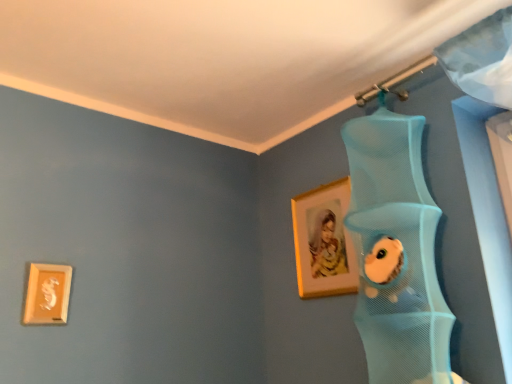
The width and height of the screenshot is (512, 384). I want to click on matte gold picture frame at upper center, the first picture frame when ordered from back to front, so click(323, 241).

What is the approximate height of matte gold picture frame at upper center, positioned as the second picture frame in front-to-back order?

matte gold picture frame at upper center, positioned as the second picture frame in front-to-back order, is 17.33 inches in height.

What do you see at coordinates (323, 241) in the screenshot?
I see `matte gold picture frame at upper center, acting as the 1th picture frame starting from the right` at bounding box center [323, 241].

Locate an element on the screen. The height and width of the screenshot is (384, 512). matte gold picture frame at lower left, arranged as the second picture frame when viewed from the right is located at coordinates (47, 294).

Describe the element at coordinates (47, 294) in the screenshot. I see `matte gold picture frame at lower left, arranged as the second picture frame when viewed from the right` at that location.

In order to face matte gold picture frame at lower left, acting as the second picture frame starting from the back, should I rotate leftwards or rightwards?

Rotate your view left by about 25.794°.

Where is `matte gold picture frame at upper center, the 2th picture frame viewed from the left`? Image resolution: width=512 pixels, height=384 pixels. matte gold picture frame at upper center, the 2th picture frame viewed from the left is located at coordinates (323, 241).

Visually, is matte gold picture frame at upper center, the 2th picture frame viewed from the left, positioned to the left or to the right of matte gold picture frame at lower left, which is counted as the 1th picture frame, starting from the front?

matte gold picture frame at upper center, the 2th picture frame viewed from the left, is to the right of matte gold picture frame at lower left, which is counted as the 1th picture frame, starting from the front.

Which object is further away from the camera taking this photo, matte gold picture frame at upper center, acting as the 1th picture frame starting from the right, or matte gold picture frame at lower left, acting as the second picture frame starting from the back?

matte gold picture frame at upper center, acting as the 1th picture frame starting from the right, is further away from the camera.

Does point (304, 205) come in front of point (60, 278)?

No.

From the image's perspective, is matte gold picture frame at upper center, the 2th picture frame viewed from the left, above or below matte gold picture frame at lower left, which is counted as the 1th picture frame, starting from the front?

matte gold picture frame at upper center, the 2th picture frame viewed from the left, is above matte gold picture frame at lower left, which is counted as the 1th picture frame, starting from the front.

From a real-world perspective, is matte gold picture frame at upper center, the first picture frame when ordered from back to front, positioned over matte gold picture frame at lower left, acting as the second picture frame starting from the back, based on gravity?

Indeed, from a real-world perspective, matte gold picture frame at upper center, the first picture frame when ordered from back to front, stands above matte gold picture frame at lower left, acting as the second picture frame starting from the back.

Can you confirm if matte gold picture frame at upper center, the first picture frame when ordered from back to front, is wider than matte gold picture frame at lower left, acting as the second picture frame starting from the back?

No.

Can you confirm if matte gold picture frame at upper center, the 2th picture frame viewed from the left, is shorter than matte gold picture frame at lower left, arranged as the second picture frame when viewed from the right?

No.

Considering the sizes of objects matte gold picture frame at upper center, the 2th picture frame viewed from the left, and matte gold picture frame at lower left, which is the first picture frame from left to right, in the image provided, who is bigger, matte gold picture frame at upper center, the 2th picture frame viewed from the left, or matte gold picture frame at lower left, which is the first picture frame from left to right,?

With larger size is matte gold picture frame at upper center, the 2th picture frame viewed from the left.

Would you say matte gold picture frame at upper center, the 2th picture frame viewed from the left, contains matte gold picture frame at lower left, which is the first picture frame from left to right?

That's incorrect, matte gold picture frame at lower left, which is the first picture frame from left to right, is not inside matte gold picture frame at upper center, the 2th picture frame viewed from the left.

Would you consider matte gold picture frame at upper center, positioned as the second picture frame in front-to-back order, to be distant from matte gold picture frame at lower left, which is the first picture frame from left to right?

That's not correct — matte gold picture frame at upper center, positioned as the second picture frame in front-to-back order, is a little close to matte gold picture frame at lower left, which is the first picture frame from left to right.

Is matte gold picture frame at upper center, acting as the 1th picture frame starting from the right, looking in the opposite direction of matte gold picture frame at lower left, which is the first picture frame from left to right?

No, matte gold picture frame at upper center, acting as the 1th picture frame starting from the right, is not facing away from matte gold picture frame at lower left, which is the first picture frame from left to right.

How many degrees apart are the facing directions of matte gold picture frame at upper center, acting as the 1th picture frame starting from the right, and matte gold picture frame at lower left, acting as the second picture frame starting from the back?

The angle between the facing direction of matte gold picture frame at upper center, acting as the 1th picture frame starting from the right, and the facing direction of matte gold picture frame at lower left, acting as the second picture frame starting from the back, is 90.2 degrees.

How much distance is there between matte gold picture frame at upper center, the 2th picture frame viewed from the left, and matte gold picture frame at lower left, acting as the second picture frame starting from the back?

matte gold picture frame at upper center, the 2th picture frame viewed from the left, and matte gold picture frame at lower left, acting as the second picture frame starting from the back, are 37.46 inches apart.

The height and width of the screenshot is (384, 512). Find the location of `picture frame that is on the right side of matte gold picture frame at lower left, which is the first picture frame from left to right`. picture frame that is on the right side of matte gold picture frame at lower left, which is the first picture frame from left to right is located at coordinates (323, 241).

Based on their positions, is matte gold picture frame at lower left, which is the first picture frame from left to right, located to the left or right of matte gold picture frame at upper center, the 2th picture frame viewed from the left?

matte gold picture frame at lower left, which is the first picture frame from left to right, is to the left of matte gold picture frame at upper center, the 2th picture frame viewed from the left.

In the scene shown: Considering the relative positions of matte gold picture frame at lower left, which is counted as the 1th picture frame, starting from the front, and matte gold picture frame at upper center, the first picture frame when ordered from back to front, in the image provided, is matte gold picture frame at lower left, which is counted as the 1th picture frame, starting from the front, behind matte gold picture frame at upper center, the first picture frame when ordered from back to front,?

No, the depth of matte gold picture frame at lower left, which is counted as the 1th picture frame, starting from the front, is less than that of matte gold picture frame at upper center, the first picture frame when ordered from back to front.

Does point (58, 265) appear closer or farther from the camera than point (304, 249)?

Point (58, 265) is positioned closer to the camera compared to point (304, 249).

From the image's perspective, is matte gold picture frame at lower left, which is the first picture frame from left to right, on top of matte gold picture frame at upper center, the 2th picture frame viewed from the left?

No, from the image's perspective, matte gold picture frame at lower left, which is the first picture frame from left to right, is not above matte gold picture frame at upper center, the 2th picture frame viewed from the left.

From the picture: From a real-world perspective, is matte gold picture frame at lower left, which is counted as the 1th picture frame, starting from the front, physically above matte gold picture frame at upper center, acting as the 1th picture frame starting from the right?

No, from a real-world perspective, matte gold picture frame at lower left, which is counted as the 1th picture frame, starting from the front, is not over matte gold picture frame at upper center, acting as the 1th picture frame starting from the right

Can you confirm if matte gold picture frame at lower left, acting as the second picture frame starting from the back, is wider than matte gold picture frame at upper center, the first picture frame when ordered from back to front?

Yes, matte gold picture frame at lower left, acting as the second picture frame starting from the back, is wider than matte gold picture frame at upper center, the first picture frame when ordered from back to front.

Between matte gold picture frame at lower left, acting as the second picture frame starting from the back, and matte gold picture frame at upper center, the 2th picture frame viewed from the left, which one has more height?

matte gold picture frame at upper center, the 2th picture frame viewed from the left, is taller.

Between matte gold picture frame at lower left, which is counted as the 1th picture frame, starting from the front, and matte gold picture frame at upper center, positioned as the second picture frame in front-to-back order, which one has larger size?

With larger size is matte gold picture frame at upper center, positioned as the second picture frame in front-to-back order.

Is matte gold picture frame at lower left, which is counted as the 1th picture frame, starting from the front, not within matte gold picture frame at upper center, the first picture frame when ordered from back to front?

Indeed, matte gold picture frame at lower left, which is counted as the 1th picture frame, starting from the front, is completely outside matte gold picture frame at upper center, the first picture frame when ordered from back to front.

Is matte gold picture frame at lower left, which is counted as the 1th picture frame, starting from the front, not near matte gold picture frame at upper center, acting as the 1th picture frame starting from the right?

They are positioned close to each other.

Is matte gold picture frame at lower left, arranged as the second picture frame when viewed from the right, facing away from matte gold picture frame at upper center, positioned as the second picture frame in front-to-back order?

matte gold picture frame at lower left, arranged as the second picture frame when viewed from the right, is not turned away from matte gold picture frame at upper center, positioned as the second picture frame in front-to-back order.

Locate an element on the screen. picture frame in front of the matte gold picture frame at upper center, the 2th picture frame viewed from the left is located at coordinates (47, 294).

Image resolution: width=512 pixels, height=384 pixels. What are the coordinates of `picture frame above the matte gold picture frame at lower left, which is the first picture frame from left to right (from the image's perspective)` in the screenshot? It's located at (323, 241).

Where is `picture frame below the matte gold picture frame at upper center, the first picture frame when ordered from back to front (from the image's perspective)`? The height and width of the screenshot is (384, 512). picture frame below the matte gold picture frame at upper center, the first picture frame when ordered from back to front (from the image's perspective) is located at coordinates (47, 294).